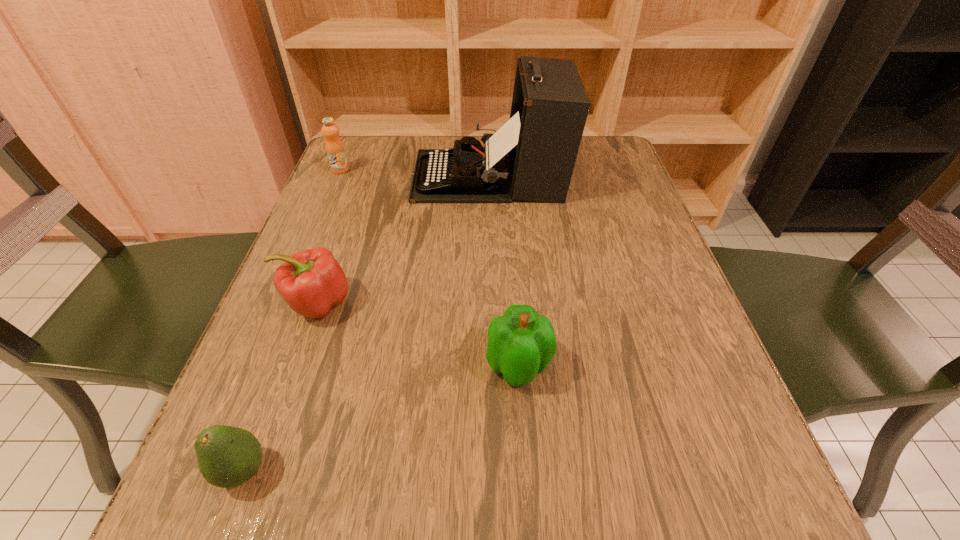
At what (x,y) coordinates should I click in order to perform the action: click on vacant space that is in between the second nearest object and the typewriter. Please return your answer as a coordinate pair (x, y). This screenshot has height=540, width=960. Looking at the image, I should click on (504, 271).

At what (x,y) coordinates should I click in order to perform the action: click on free space between the farther bell pepper and the typewriter. Please return your answer as a coordinate pair (x, y). The image size is (960, 540). Looking at the image, I should click on click(403, 240).

In order to click on free space between the avocado and the orange juice in this screenshot , I will do `click(292, 320)`.

Locate an element on the screen. The height and width of the screenshot is (540, 960). free space that is in between the typewriter and the farther bell pepper is located at coordinates (403, 240).

The width and height of the screenshot is (960, 540). In order to click on free space between the right bell pepper and the third nearest object in this screenshot , I will do click(419, 334).

Locate an element on the screen. The height and width of the screenshot is (540, 960). free space between the second nearest object and the third nearest object is located at coordinates (419, 334).

What are the coordinates of `vacant space in between the nearest object and the left bell pepper` in the screenshot? It's located at (280, 387).

The width and height of the screenshot is (960, 540). Identify the location of object that stands as the closest to the orange juice. (531, 157).

Locate which object ranks second in proximity to the nearest object. Please provide its 2D coordinates. Your answer should be formatted as a tuple, i.e. [(x, y)], where the tuple contains the x and y coordinates of a point satisfying the conditions above.

[(521, 343)]

Where is `vacant space that satisfies the following two spatial constraints: 1. on the back side of the left bell pepper; 2. on the left side of the nearest object`? vacant space that satisfies the following two spatial constraints: 1. on the back side of the left bell pepper; 2. on the left side of the nearest object is located at coordinates (306, 303).